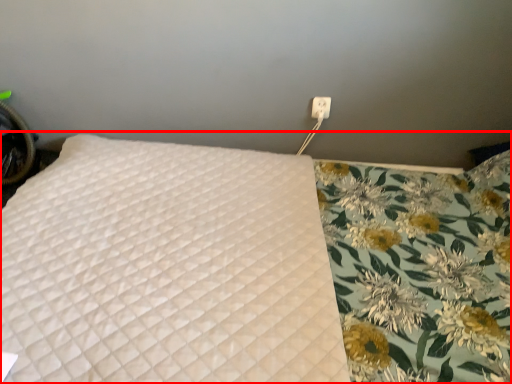
Question: From the image's perspective, considering the relative positions of bed (annotated by the red box) and electric outlet in the image provided, where is bed (annotated by the red box) located with respect to the staircase?

Choices:
 (A) below
 (B) above

Answer: (A)